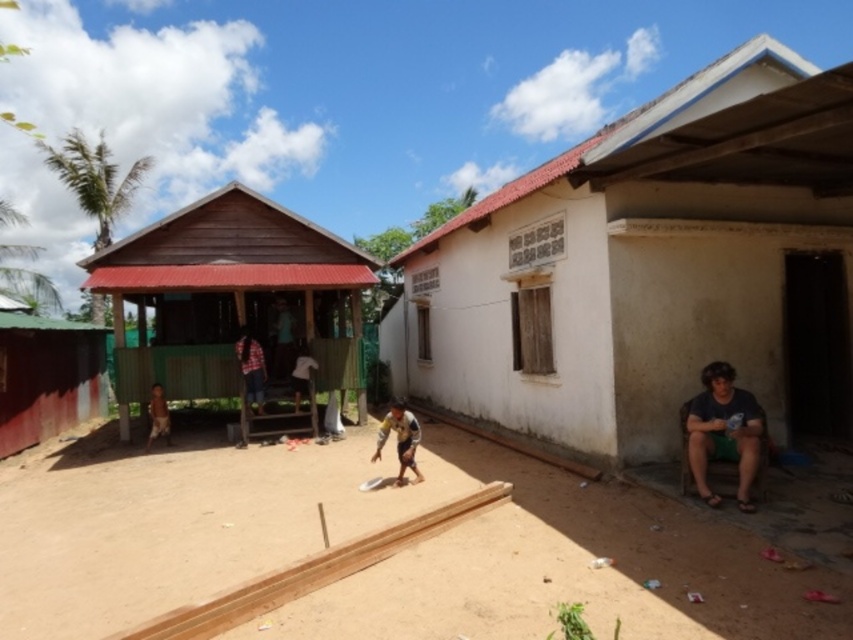
You are standing in the rural outdoor scene described. You see a wooden hut at center and a brown fabric shirt at center. Which object is positioned to the left?

The wooden hut at center is to the left of the brown fabric shirt at center.

You are planning to place a new signboard next to the wooden hut at center and the brown fabric shirt at center. Since the signboard must be placed closer to the narrower object, which object should the signboard be placed next to?

The wooden hut at center has a lesser width compared to brown fabric shirt at center, so the signboard should be placed next to the wooden hut at center.